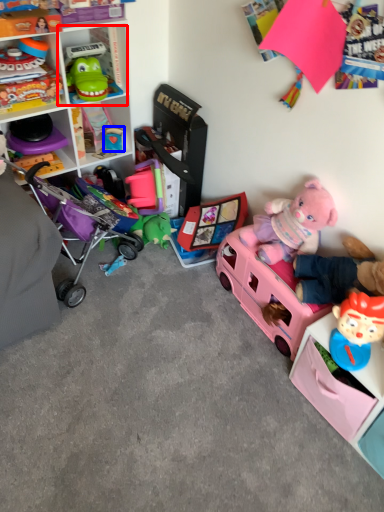
Question: Which object appears farthest to the camera in this image, cabinet (highlighted by a red box) or toy (highlighted by a blue box)?

Choices:
 (A) cabinet
 (B) toy

Answer: (B)